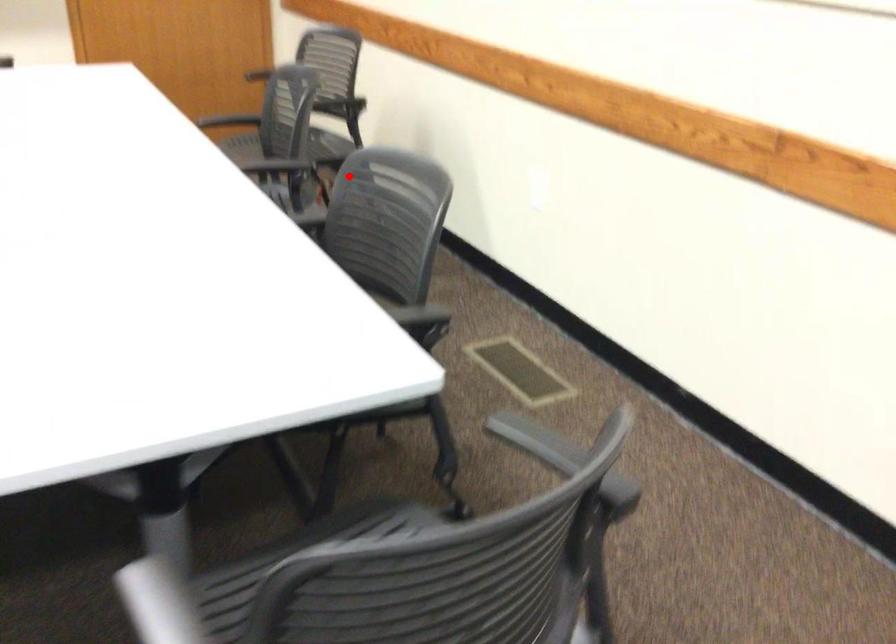
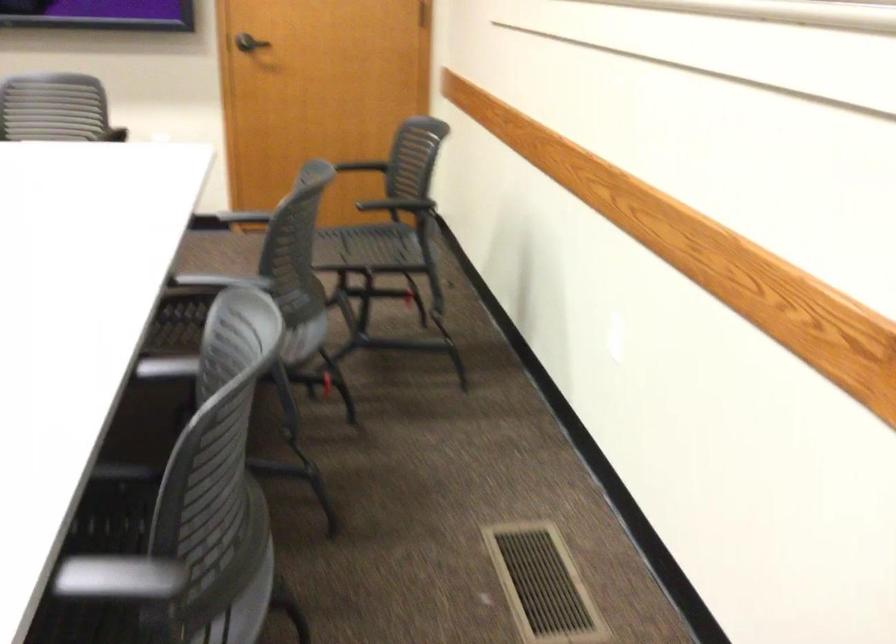
Locate, in the second image, the point that corresponds to the highlighted location in the first image.

(225, 319)